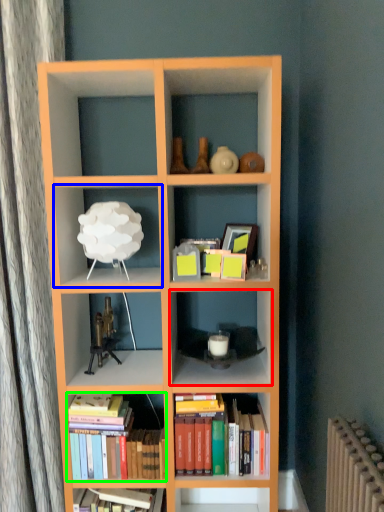
Question: Which is nearer to the shelf (highlighted by a red box)? shelf (highlighted by a blue box) or book (highlighted by a green box).

Choices:
 (A) shelf
 (B) book

Answer: (B)